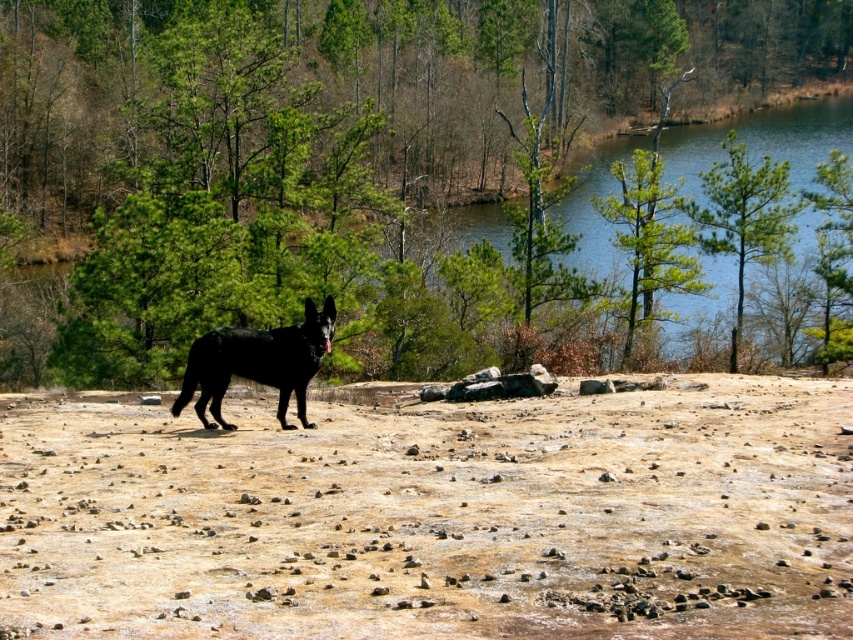
Question: Which of these objects is positioned closest to the green textured pine tree at upper center?

Choices:
 (A) green leafy tree at center
 (B) shiny black dog at center
 (C) green matte tree at upper right
 (D) brown sandy soil at center

Answer: (C)

Question: Which object is positioned farthest from the green leafy tree at upper right?

Choices:
 (A) shiny black dog at center
 (B) green textured pine tree at upper center
 (C) brown sandy soil at center

Answer: (A)

Question: Is brown sandy soil at center in front of shiny black dog at center?

Choices:
 (A) no
 (B) yes

Answer: (B)

Question: Does green textured pine tree at upper center have a larger size compared to green leafy tree at upper right?

Choices:
 (A) no
 (B) yes

Answer: (B)

Question: Which of the following is the closest to the observer?

Choices:
 (A) (839, 236)
 (B) (434, 61)
 (C) (637, 262)
 (D) (728, 253)

Answer: (A)

Question: Can you confirm if shiny black dog at center is bigger than green textured pine tree at upper center?

Choices:
 (A) no
 (B) yes

Answer: (A)